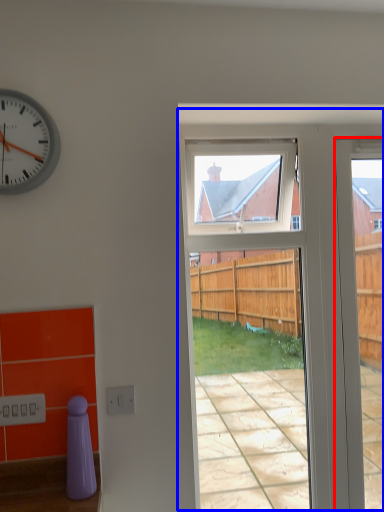
Question: Which of the following is the closest to the observer, door (highlighted by a red box) or screen door (highlighted by a blue box)?

Choices:
 (A) door
 (B) screen door

Answer: (B)